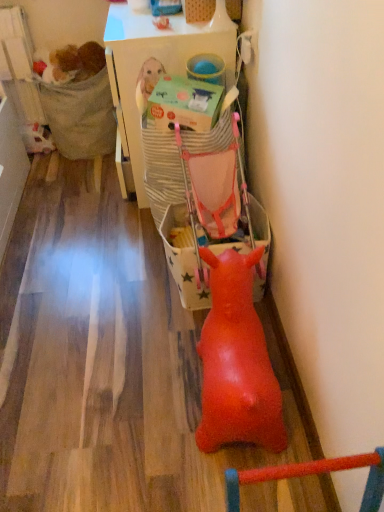
I want to click on blank space to the left of white plastic table at upper center, so click(67, 192).